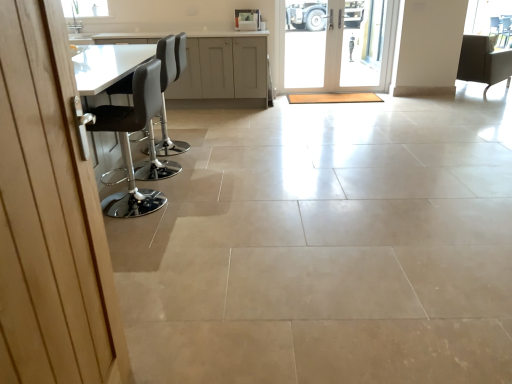
Question: Should I look upward or downward to see black leather stool at left, which ranks as the 3th chair in back-to-front order?

Choices:
 (A) down
 (B) up

Answer: (B)

Question: Could you tell me if black leather stool at left, the second chair positioned from the right, is turned towards matte gray cabinets at upper center?

Choices:
 (A) yes
 (B) no

Answer: (B)

Question: Is the position of black leather stool at left, the second chair positioned from the right, less distant than that of matte gray cabinets at upper center?

Choices:
 (A) no
 (B) yes

Answer: (B)

Question: Is black leather stool at left, the second chair positioned from the right, positioned far away from matte gray cabinets at upper center?

Choices:
 (A) no
 (B) yes

Answer: (B)

Question: From a real-world perspective, is black leather stool at left, the first chair when ordered from front to back, below matte gray cabinets at upper center?

Choices:
 (A) yes
 (B) no

Answer: (A)

Question: From a real-world perspective, is black leather stool at left, which is the 2th chair in left-to-right order, physically above matte gray cabinets at upper center?

Choices:
 (A) yes
 (B) no

Answer: (B)

Question: Does black leather stool at left, the first chair when ordered from front to back, appear on the right side of matte gray cabinets at upper center?

Choices:
 (A) yes
 (B) no

Answer: (A)

Question: From a real-world perspective, does matte gray cabinets at upper center stand above black leather stool at left, which ranks as the 3th chair in back-to-front order?

Choices:
 (A) no
 (B) yes

Answer: (B)

Question: From the image's perspective, would you say matte gray cabinets at upper center is positioned over black leather stool at left, the second chair positioned from the right?

Choices:
 (A) no
 (B) yes

Answer: (B)

Question: Considering the relative sizes of matte gray cabinets at upper center and black leather stool at left, which is the 2th chair in left-to-right order, in the image provided, is matte gray cabinets at upper center smaller than black leather stool at left, which is the 2th chair in left-to-right order,?

Choices:
 (A) no
 (B) yes

Answer: (A)

Question: From a real-world perspective, is matte gray cabinets at upper center below black leather stool at left, the first chair when ordered from front to back?

Choices:
 (A) no
 (B) yes

Answer: (A)

Question: Is matte gray cabinets at upper center to the right of black leather stool at left, the first chair when ordered from front to back, from the viewer's perspective?

Choices:
 (A) yes
 (B) no

Answer: (B)

Question: From the image's perspective, is matte gray cabinets at upper center beneath black leather stool at left, the first chair when ordered from front to back?

Choices:
 (A) yes
 (B) no

Answer: (B)

Question: Is matte gray cabinets at upper center oriented towards matte black chair at upper right, which is the 1th chair in right-to-left order?

Choices:
 (A) no
 (B) yes

Answer: (A)